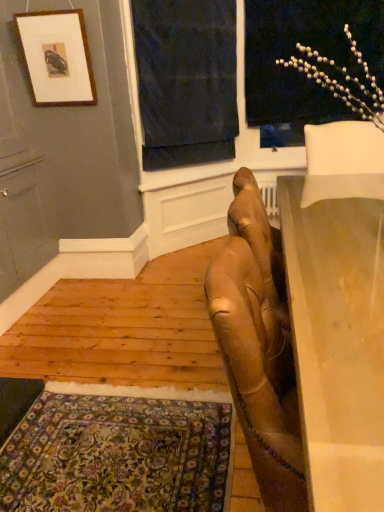
The height and width of the screenshot is (512, 384). What are the coordinates of `vacant space situated above carpeted rug at lower left (from a real-world perspective)` in the screenshot? It's located at (114, 444).